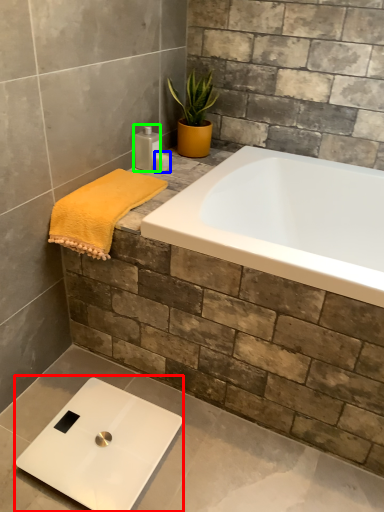
Question: Which is nearer to the scale (highlighted by a red box)? toiletry (highlighted by a blue box) or toiletry (highlighted by a green box).

Choices:
 (A) toiletry
 (B) toiletry

Answer: (B)